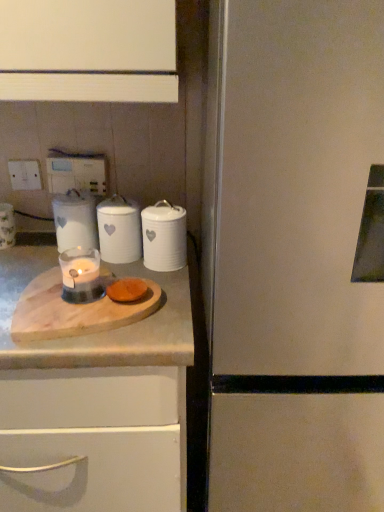
Locate an element on the screen. vacant region to the left of white ceramic candle at center, the third kitchen appliance when ordered from right to left is located at coordinates (33, 252).